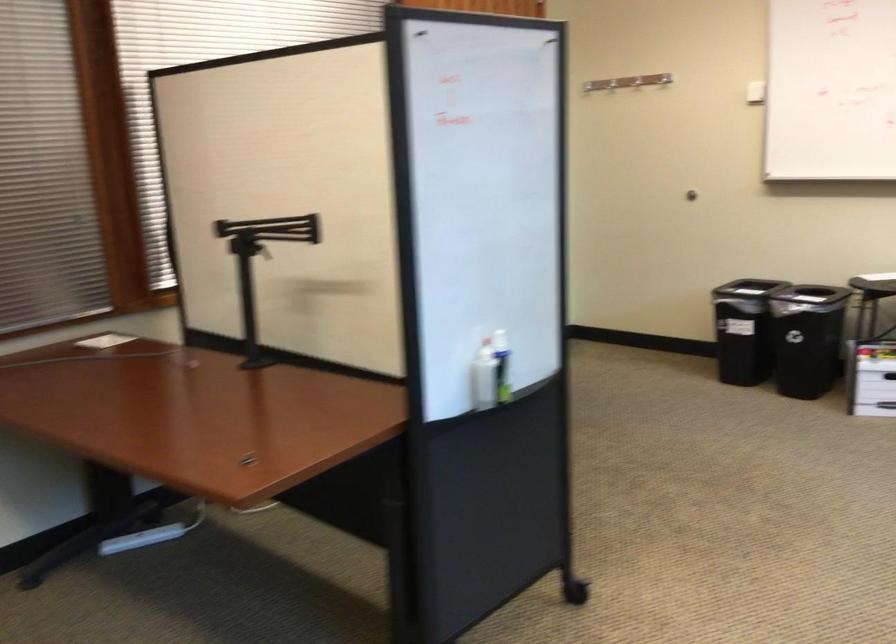
Where is `black monitor arm`? black monitor arm is located at coordinates (261, 263).